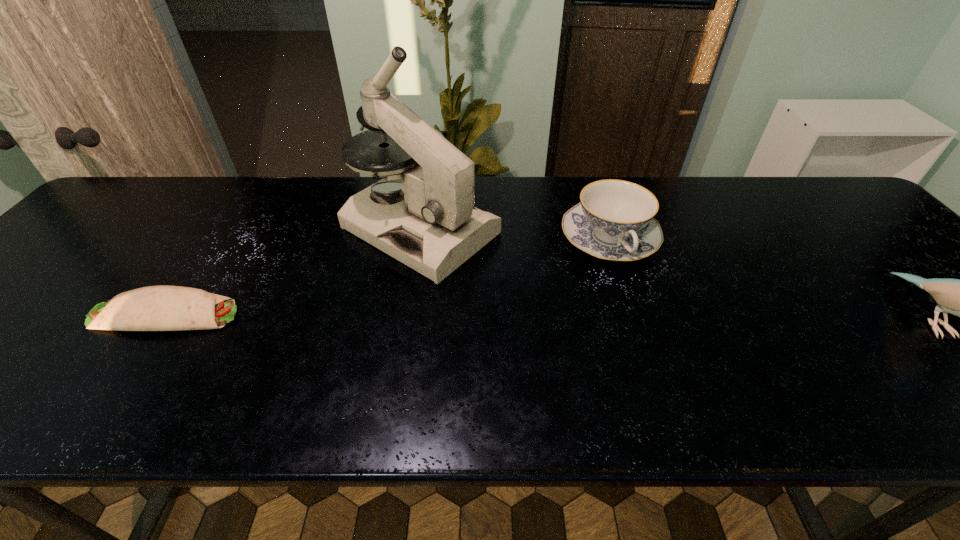
Where is `free space that is in between the chinaware and the shortest object`? This screenshot has width=960, height=540. free space that is in between the chinaware and the shortest object is located at coordinates point(387,278).

At what (x,y) coordinates should I click in order to perform the action: click on vacant area that lies between the burrito and the tallest object. Please return your answer as a coordinate pair (x, y). The image size is (960, 540). Looking at the image, I should click on (293, 272).

Locate an element on the screen. This screenshot has height=540, width=960. free spot between the second object from left to right and the burrito is located at coordinates (293, 272).

Locate an element on the screen. empty space that is in between the microscope and the second shortest object is located at coordinates (515, 235).

Image resolution: width=960 pixels, height=540 pixels. In order to click on free space between the chinaware and the burrito in this screenshot , I will do `click(387, 278)`.

I want to click on free point between the tallest object and the burrito, so click(x=293, y=272).

Locate an element on the screen. free point between the second object from left to right and the leftmost object is located at coordinates (293, 272).

Locate which object ranks second in proximity to the third object from right to left. Please provide its 2D coordinates. Your answer should be formatted as a tuple, i.e. [(x, y)], where the tuple contains the x and y coordinates of a point satisfying the conditions above.

[(154, 308)]

You are a GUI agent. You are given a task and a screenshot of the screen. Output one action in this format:
    pyautogui.click(x=<x>, y=<y>)
    Task: Click on the second closest object to the leftmost object
    This screenshot has width=960, height=540.
    Given the screenshot: What is the action you would take?
    pyautogui.click(x=614, y=221)